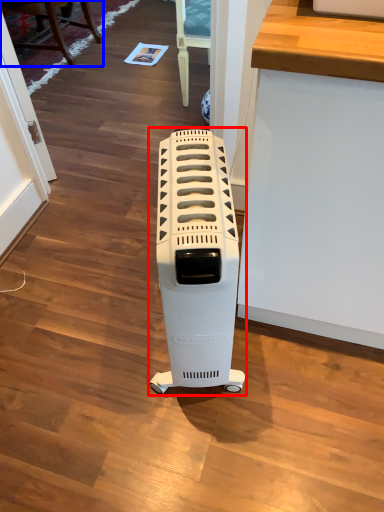
Question: Which of the following is the farthest to the observer, home appliance (highlighted by a red box) or furniture (highlighted by a blue box)?

Choices:
 (A) home appliance
 (B) furniture

Answer: (B)